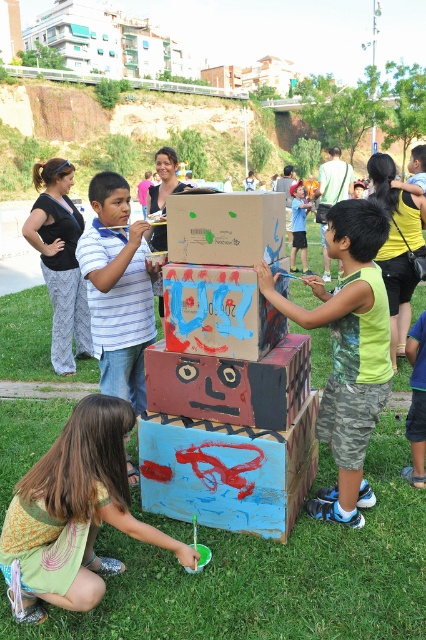
Between green fabric dress at lower left and blue painted cardboard box at lower center, which one appears on the left side from the viewer's perspective?

From the viewer's perspective, green fabric dress at lower left appears more on the left side.

Which is behind, point (39, 552) or point (265, 461)?

Point (265, 461)

Find the location of a particular element. Image resolution: width=426 pixels, height=640 pixels. green fabric dress at lower left is located at coordinates (74, 515).

Can you confirm if green grass at lower center is wider than blue painted cardboard box at lower center?

Yes, green grass at lower center is wider than blue painted cardboard box at lower center.

Between green grass at lower center and blue painted cardboard box at lower center, which one appears on the left side from the viewer's perspective?

Positioned to the left is blue painted cardboard box at lower center.

I want to click on green grass at lower center, so click(271, 576).

Between green camouflage shorts at center and cardboard box at center, which one has more height?

green camouflage shorts at center is taller.

Who is positioned more to the left, green camouflage shorts at center or cardboard box at center?

From the viewer's perspective, cardboard box at center appears more on the left side.

Where is `green camouflage shorts at center`? Image resolution: width=426 pixels, height=640 pixels. green camouflage shorts at center is located at coordinates tap(348, 348).